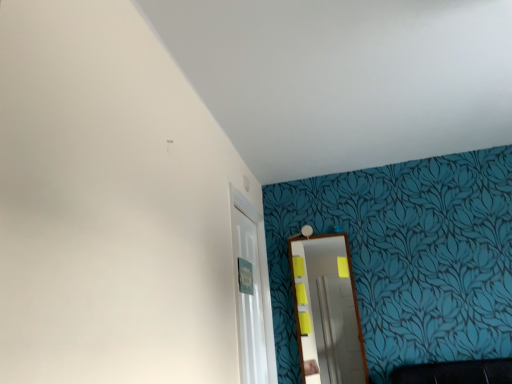
What is the approximate height of white glossy door at center?

white glossy door at center is 1.07 meters tall.

Locate an element on the screen. white glossy door at center is located at coordinates (249, 293).

What do you see at coordinates (249, 293) in the screenshot?
I see `white glossy door at center` at bounding box center [249, 293].

In order to face white glossy door at center, should I rotate leftwards or rightwards?

You should rotate right by 0.069 degrees.

This screenshot has width=512, height=384. In order to click on wooden mirror at center in this screenshot , I will do `click(329, 311)`.

What do you see at coordinates (329, 311) in the screenshot?
I see `wooden mirror at center` at bounding box center [329, 311].

Measure the distance between wooden mirror at center and camera.

wooden mirror at center and camera are 8.37 feet apart.

At what (x,y) coordinates should I click in order to perform the action: click on white glossy door at center. Please return your answer as a coordinate pair (x, y). This screenshot has width=512, height=384. Looking at the image, I should click on (249, 293).

Which object is positioned more to the left, wooden mirror at center or white glossy door at center?

white glossy door at center.

Based on the photo, which is in front, wooden mirror at center or white glossy door at center?

white glossy door at center is closer to the camera.

Which point is more distant from viewer, (300, 277) or (263, 306)?

The point (300, 277) is farther.

From the image's perspective, between wooden mirror at center and white glossy door at center, who is located below?

wooden mirror at center appears lower in the image.

From a real-world perspective, is wooden mirror at center above or below white glossy door at center?

wooden mirror at center is situated lower than white glossy door at center in the real world.

Between wooden mirror at center and white glossy door at center, which one has larger width?

Wider between the two is white glossy door at center.

Who is shorter, wooden mirror at center or white glossy door at center?

Standing shorter between the two is wooden mirror at center.

Can you confirm if wooden mirror at center is bigger than white glossy door at center?

No.

From the picture: Would you say wooden mirror at center is inside or outside white glossy door at center?

wooden mirror at center exists outside the volume of white glossy door at center.

Is wooden mirror at center not near white glossy door at center?

No.

Is wooden mirror at center facing away from white glossy door at center?

No, wooden mirror at center's orientation is not away from white glossy door at center.

Identify the location of mirror beneath the white glossy door at center (from a real-world perspective). The image size is (512, 384). (329, 311).

Which object is positioned more to the right, white glossy door at center or wooden mirror at center?

From the viewer's perspective, wooden mirror at center appears more on the right side.

Considering the positions of objects white glossy door at center and wooden mirror at center in the image provided, who is behind, white glossy door at center or wooden mirror at center?

wooden mirror at center is further away from the camera.

Which point is more distant from viewer, (241, 295) or (333, 272)?

The point (333, 272) is more distant.

Looking at this image, from the image's perspective, is white glossy door at center located above or below wooden mirror at center?

Based on their image positions, white glossy door at center is located above wooden mirror at center.

From a real-world perspective, between white glossy door at center and wooden mirror at center, who is vertically lower?

wooden mirror at center is physically lower.

Is white glossy door at center thinner than wooden mirror at center?

Incorrect, the width of white glossy door at center is not less than that of wooden mirror at center.

Which of these two, white glossy door at center or wooden mirror at center, stands taller?

With more height is white glossy door at center.

In the scene shown: Which of these two, white glossy door at center or wooden mirror at center, is bigger?

white glossy door at center is bigger.

Is white glossy door at center outside of wooden mirror at center?

white glossy door at center lies outside wooden mirror at center's area.

Is white glossy door at center far away from wooden mirror at center?

No, white glossy door at center is in close proximity to wooden mirror at center.

Is white glossy door at center facing away from wooden mirror at center?

That's not correct — white glossy door at center is not looking away from wooden mirror at center.

From the picture: What's the angular difference between white glossy door at center and wooden mirror at center's facing directions?

87.9 degrees separate the facing orientations of white glossy door at center and wooden mirror at center.

Locate an element on the screen. The image size is (512, 384). mirror below the white glossy door at center (from the image's perspective) is located at coordinates (329, 311).

Locate an element on the screen. The width and height of the screenshot is (512, 384). glass door that is above the wooden mirror at center (from the image's perspective) is located at coordinates click(249, 293).

Where is `mirror behind the white glossy door at center`? The width and height of the screenshot is (512, 384). mirror behind the white glossy door at center is located at coordinates (329, 311).